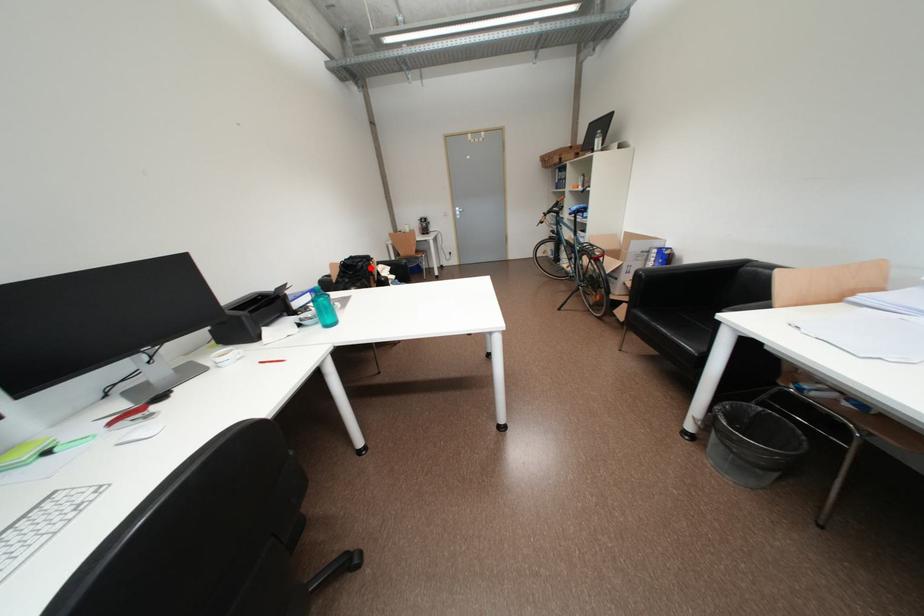
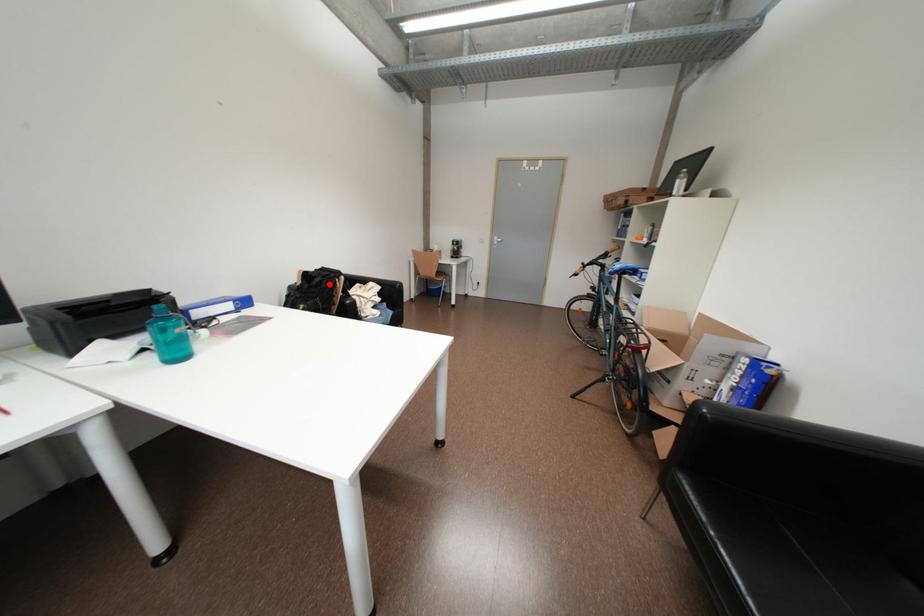
I am providing you with two images of the same scene from different viewpoints. A red point is marked on the first image and another point is marked on the second image. Do the highlighted points in image1 and image2 indicate the same real-world spot?

Yes